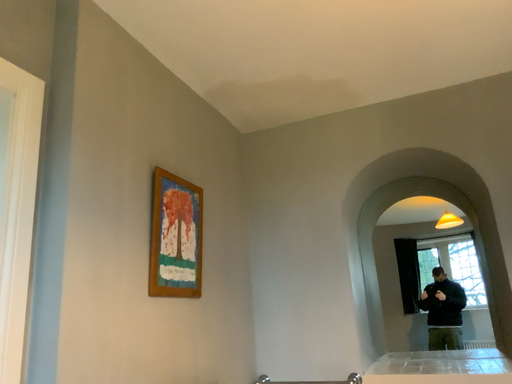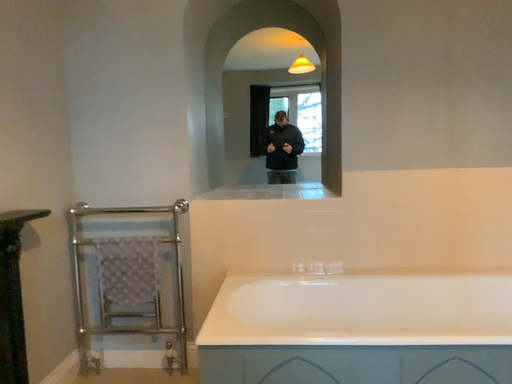
Question: Which way did the camera rotate in the video?

Choices:
 (A) rotated downward
 (B) rotated upward

Answer: (A)